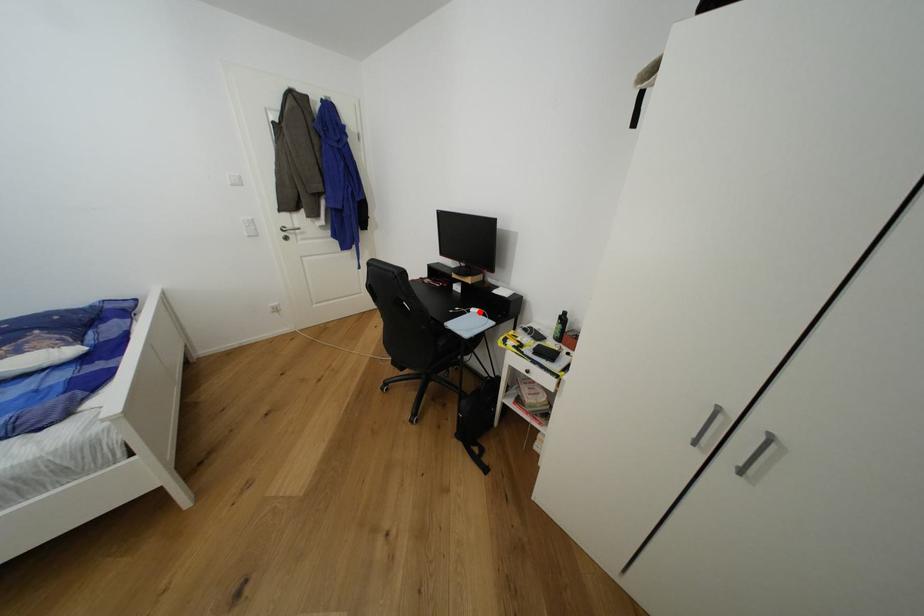
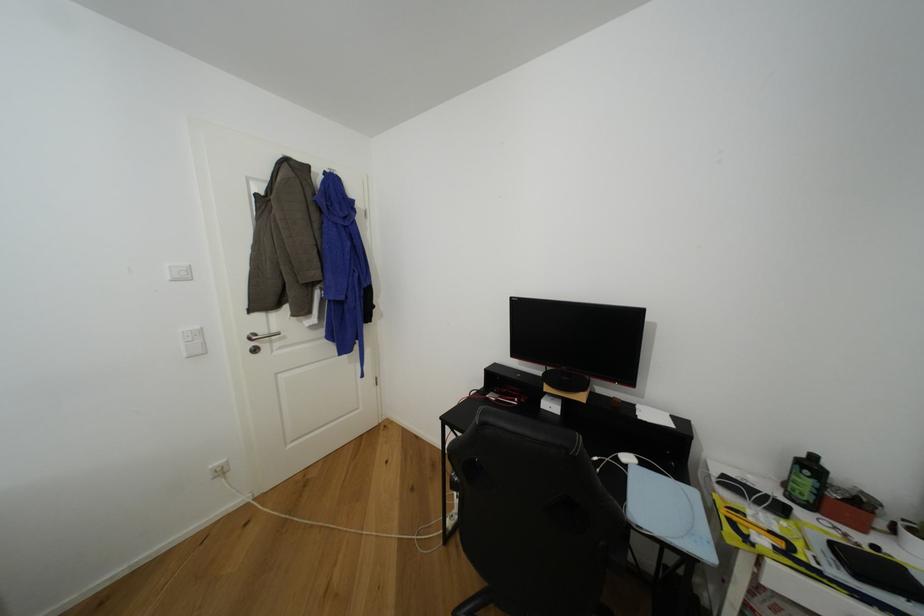
Question: I am providing you with two images of the same scene from different viewpoints. A red point is marked on the first image. At the location where the point appears in image 1, is it still visible in image 2?

Choices:
 (A) Yes
 (B) No

Answer: (A)